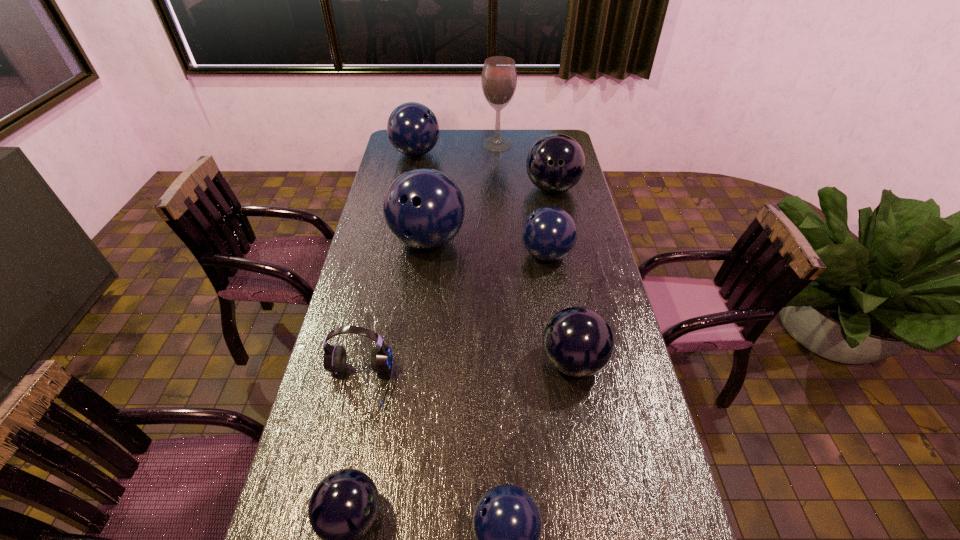
Where is `free space at the far right corner of the desktop`? This screenshot has width=960, height=540. free space at the far right corner of the desktop is located at coordinates (568, 135).

At what (x,y) coordinates should I click in order to perform the action: click on unoccupied position between the second farthest black bowling ball and the rightmost blue bowling ball. Please return your answer as a coordinate pair (x, y). The height and width of the screenshot is (540, 960). Looking at the image, I should click on (560, 308).

Where is `vacant area that lies between the biggest blue bowling ball and the second smallest blue bowling ball`? The height and width of the screenshot is (540, 960). vacant area that lies between the biggest blue bowling ball and the second smallest blue bowling ball is located at coordinates (487, 248).

The height and width of the screenshot is (540, 960). I want to click on vacant space that's between the second biggest black bowling ball and the rightmost blue bowling ball, so click(560, 308).

Identify the location of object that is the third closest to the sixth nearest bowling ball. (423, 208).

Select which object is the closest to the headset. Please provide its 2D coordinates. Your answer should be formatted as a tuple, i.e. [(x, y)], where the tuple contains the x and y coordinates of a point satisfying the conditions above.

[(345, 504)]

The image size is (960, 540). What are the coordinates of `bowling ball that is the third closest to the farthest bowling ball` in the screenshot? It's located at (549, 233).

Point out which bowling ball is positioned as the fifth nearest to the nearest blue bowling ball. Please provide its 2D coordinates. Your answer should be formatted as a tuple, i.e. [(x, y)], where the tuple contains the x and y coordinates of a point satisfying the conditions above.

[(555, 163)]

Locate which blue bowling ball is the closest to the fifth farthest bowling ball. Please provide its 2D coordinates. Your answer should be formatted as a tuple, i.e. [(x, y)], where the tuple contains the x and y coordinates of a point satisfying the conditions above.

[(549, 233)]

Identify which blue bowling ball is the closest to the tallest object. Please provide its 2D coordinates. Your answer should be formatted as a tuple, i.e. [(x, y)], where the tuple contains the x and y coordinates of a point satisfying the conditions above.

[(413, 129)]